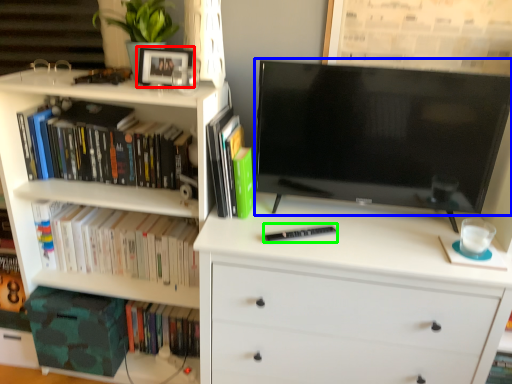
Question: Which object is positioned farthest from picture frame (highlighted by a red box)? Select from television (highlighted by a blue box) and paperback book (highlighted by a green box).

Choices:
 (A) television
 (B) paperback book

Answer: (B)